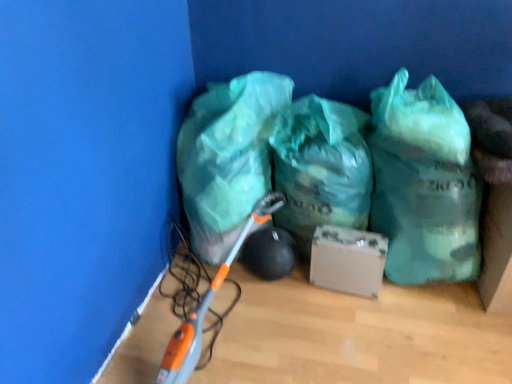
I want to click on translucent green plastic bag at lower left, arranged as the first plastic bag when viewed from the left, so click(x=228, y=157).

This screenshot has width=512, height=384. What do you see at coordinates (424, 184) in the screenshot? I see `green camouflage plastic bag at center, which ranks as the 1th plastic bag in right-to-left order` at bounding box center [424, 184].

What is the approximate height of green camouflage plastic bag at center, which ranks as the 1th plastic bag in right-to-left order?

32.28 inches.

Measure the distance between green translucent plastic bag at center, the second plastic bag viewed from the right, and camera.

green translucent plastic bag at center, the second plastic bag viewed from the right, is 5.40 feet from camera.

Find the location of `matte cardboard box at center`. matte cardboard box at center is located at coordinates pos(348,260).

This screenshot has height=384, width=512. I want to click on translucent green plastic bag at lower left, arranged as the first plastic bag when viewed from the left, so click(x=228, y=157).

At what (x,y) coordinates should I click in order to perform the action: click on cardboard box on the right of green translucent plastic bag at center, the 2th plastic bag when ordered from left to right. Please return your answer as a coordinate pair (x, y). Image resolution: width=512 pixels, height=384 pixels. Looking at the image, I should click on (348, 260).

How many degrees apart are the facing directions of matte cardboard box at center and green translucent plastic bag at center, the 2th plastic bag when ordered from left to right?

matte cardboard box at center and green translucent plastic bag at center, the 2th plastic bag when ordered from left to right, are facing 0.000211 degrees away from each other.

Which is behind, matte cardboard box at center or green translucent plastic bag at center, the second plastic bag viewed from the right?

Positioned behind is matte cardboard box at center.

Locate an element on the screen. The image size is (512, 384). plastic bag above the green translucent plastic bag at center, the second plastic bag viewed from the right (from the image's perspective) is located at coordinates (228, 157).

Considering the sizes of objects green translucent plastic bag at center, the 2th plastic bag when ordered from left to right, and translucent green plastic bag at lower left, the 3th plastic bag from the right, in the image provided, who is bigger, green translucent plastic bag at center, the 2th plastic bag when ordered from left to right, or translucent green plastic bag at lower left, the 3th plastic bag from the right,?

translucent green plastic bag at lower left, the 3th plastic bag from the right.

From a real-world perspective, which object stands above the other?

translucent green plastic bag at lower left, arranged as the first plastic bag when viewed from the left.

Is point (392, 242) closer to camera compared to point (349, 284)?

Yes, it is in front of point (349, 284).

You are a GUI agent. You are given a task and a screenshot of the screen. Output one action in this format:
    pyautogui.click(x=<x>, y=<y>)
    Task: Click on the 3rd plastic bag directly above the matte cardboard box at center (from a real-world perspective)
    The height and width of the screenshot is (384, 512).
    Given the screenshot: What is the action you would take?
    pyautogui.click(x=424, y=184)

Is green camouflage plastic bag at center, which is the third plastic bag from left to right, next to matte cardboard box at center?

No, green camouflage plastic bag at center, which is the third plastic bag from left to right, is not making contact with matte cardboard box at center.

In the image, is green camouflage plastic bag at center, which is the third plastic bag from left to right, on the left side or the right side of matte cardboard box at center?

Based on their positions, green camouflage plastic bag at center, which is the third plastic bag from left to right, is located to the right of matte cardboard box at center.

Between green camouflage plastic bag at center, which ranks as the 1th plastic bag in right-to-left order, and green translucent plastic bag at center, the second plastic bag viewed from the right, which one is positioned in front?

green camouflage plastic bag at center, which ranks as the 1th plastic bag in right-to-left order, is more forward.

From the image's perspective, which object appears higher, green camouflage plastic bag at center, which is the third plastic bag from left to right, or green translucent plastic bag at center, the second plastic bag viewed from the right?

green translucent plastic bag at center, the second plastic bag viewed from the right, from the image's perspective.

Would you say matte cardboard box at center contains translucent green plastic bag at lower left, the 3th plastic bag from the right?

No, translucent green plastic bag at lower left, the 3th plastic bag from the right, is not a part of matte cardboard box at center.

Considering the relative sizes of matte cardboard box at center and translucent green plastic bag at lower left, arranged as the first plastic bag when viewed from the left, in the image provided, is matte cardboard box at center bigger than translucent green plastic bag at lower left, arranged as the first plastic bag when viewed from the left,?

No, matte cardboard box at center is not bigger than translucent green plastic bag at lower left, arranged as the first plastic bag when viewed from the left.

From a real-world perspective, is matte cardboard box at center located beneath translucent green plastic bag at lower left, the 3th plastic bag from the right?

Correct, in the physical world, matte cardboard box at center is lower than translucent green plastic bag at lower left, the 3th plastic bag from the right.

Is matte cardboard box at center directly adjacent to translucent green plastic bag at lower left, the 3th plastic bag from the right?

No, matte cardboard box at center is not making contact with translucent green plastic bag at lower left, the 3th plastic bag from the right.

Can you confirm if translucent green plastic bag at lower left, arranged as the first plastic bag when viewed from the left, is bigger than green translucent plastic bag at center, the second plastic bag viewed from the right?

Indeed, translucent green plastic bag at lower left, arranged as the first plastic bag when viewed from the left, has a larger size compared to green translucent plastic bag at center, the second plastic bag viewed from the right.

Is translucent green plastic bag at lower left, arranged as the first plastic bag when viewed from the left, placed right next to green translucent plastic bag at center, the 2th plastic bag when ordered from left to right?

translucent green plastic bag at lower left, arranged as the first plastic bag when viewed from the left, and green translucent plastic bag at center, the 2th plastic bag when ordered from left to right, are not in contact.

From the image's perspective, is translucent green plastic bag at lower left, the 3th plastic bag from the right, positioned above or below green translucent plastic bag at center, the second plastic bag viewed from the right?

Clearly, from the image's perspective, translucent green plastic bag at lower left, the 3th plastic bag from the right, is above green translucent plastic bag at center, the second plastic bag viewed from the right.

Does translucent green plastic bag at lower left, arranged as the first plastic bag when viewed from the left, come in front of green camouflage plastic bag at center, which ranks as the 1th plastic bag in right-to-left order?

No, it is behind green camouflage plastic bag at center, which ranks as the 1th plastic bag in right-to-left order.

Considering the points (221, 158) and (385, 101), which point is behind, point (221, 158) or point (385, 101)?

Positioned behind is point (221, 158).

Who is bigger, translucent green plastic bag at lower left, arranged as the first plastic bag when viewed from the left, or green camouflage plastic bag at center, which is the third plastic bag from left to right?

translucent green plastic bag at lower left, arranged as the first plastic bag when viewed from the left.

Starting from the matte cardboard box at center, which plastic bag is the 1st one in front? Please provide its 2D coordinates.

[(321, 167)]

In the image, there is a green translucent plastic bag at center, the 2th plastic bag when ordered from left to right. Identify the location of plastic bag above it (from the image's perspective). (228, 157).

Considering their positions, is green camouflage plastic bag at center, which is the third plastic bag from left to right, positioned closer to matte cardboard box at center than translucent green plastic bag at lower left, arranged as the first plastic bag when viewed from the left?

green camouflage plastic bag at center, which is the third plastic bag from left to right, lies closer to matte cardboard box at center than the other object.

When comparing their distances from green translucent plastic bag at center, the second plastic bag viewed from the right, does matte cardboard box at center or translucent green plastic bag at lower left, arranged as the first plastic bag when viewed from the left, seem closer?

matte cardboard box at center.

From the picture: When comparing their distances from green translucent plastic bag at center, the second plastic bag viewed from the right, does green camouflage plastic bag at center, which ranks as the 1th plastic bag in right-to-left order, or translucent green plastic bag at lower left, arranged as the first plastic bag when viewed from the left, seem closer?

green camouflage plastic bag at center, which ranks as the 1th plastic bag in right-to-left order.

Based on their spatial positions, is translucent green plastic bag at lower left, arranged as the first plastic bag when viewed from the left, or matte cardboard box at center further from green camouflage plastic bag at center, which ranks as the 1th plastic bag in right-to-left order?

translucent green plastic bag at lower left, arranged as the first plastic bag when viewed from the left, is further to green camouflage plastic bag at center, which ranks as the 1th plastic bag in right-to-left order.

Considering their positions, is matte cardboard box at center positioned closer to green camouflage plastic bag at center, which ranks as the 1th plastic bag in right-to-left order, than translucent green plastic bag at lower left, arranged as the first plastic bag when viewed from the left?

matte cardboard box at center is positioned closer to the anchor green camouflage plastic bag at center, which ranks as the 1th plastic bag in right-to-left order.

In the scene shown: Which object lies nearer to the anchor point translucent green plastic bag at lower left, the 3th plastic bag from the right, matte cardboard box at center or green translucent plastic bag at center, the 2th plastic bag when ordered from left to right?

→ green translucent plastic bag at center, the 2th plastic bag when ordered from left to right, is closer to translucent green plastic bag at lower left, the 3th plastic bag from the right.

Based on their spatial positions, is matte cardboard box at center or green translucent plastic bag at center, the 2th plastic bag when ordered from left to right, further from green camouflage plastic bag at center, which is the third plastic bag from left to right?

Among the two, matte cardboard box at center is located further to green camouflage plastic bag at center, which is the third plastic bag from left to right.

From the image, which object appears to be nearer to green camouflage plastic bag at center, which ranks as the 1th plastic bag in right-to-left order, green translucent plastic bag at center, the second plastic bag viewed from the right, or translucent green plastic bag at lower left, the 3th plastic bag from the right?

green translucent plastic bag at center, the second plastic bag viewed from the right.

The image size is (512, 384). I want to click on cardboard box situated between translucent green plastic bag at lower left, arranged as the first plastic bag when viewed from the left, and green camouflage plastic bag at center, which ranks as the 1th plastic bag in right-to-left order, from left to right, so click(348, 260).

Identify the location of plastic bag between translucent green plastic bag at lower left, arranged as the first plastic bag when viewed from the left, and green camouflage plastic bag at center, which is the third plastic bag from left to right. The width and height of the screenshot is (512, 384). (321, 167).

What are the coordinates of `cardboard box between green translucent plastic bag at center, the second plastic bag viewed from the right, and green camouflage plastic bag at center, which ranks as the 1th plastic bag in right-to-left order, from left to right` in the screenshot? It's located at (348, 260).

Find the location of `plastic bag between translucent green plastic bag at lower left, the 3th plastic bag from the right, and matte cardboard box at center from left to right`. plastic bag between translucent green plastic bag at lower left, the 3th plastic bag from the right, and matte cardboard box at center from left to right is located at coordinates (321, 167).